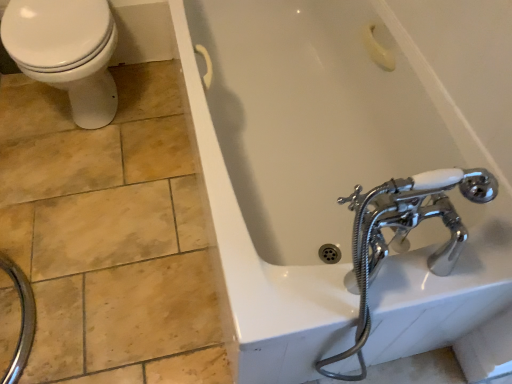
Identify the location of empty space that is in between white glossy toilet at upper left and white glossy bathtub at upper center. The height and width of the screenshot is (384, 512). (150, 216).